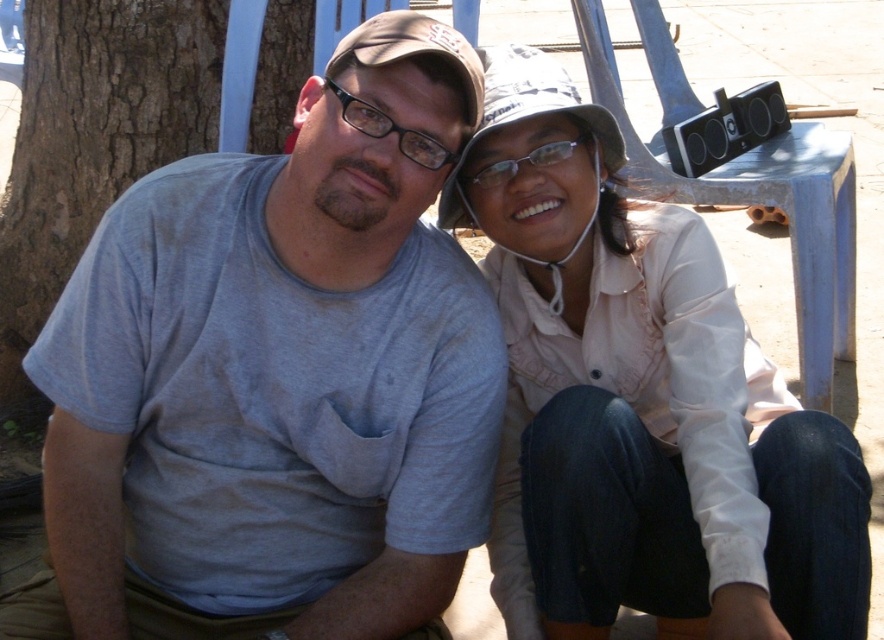
Question: Among these points, which one is nearest to the camera?

Choices:
 (A) (608, 140)
 (B) (593, 140)
 (C) (414, 545)
 (D) (856, 532)

Answer: (D)

Question: Which object is closer to the camera taking this photo?

Choices:
 (A) brown rough bark at left
 (B) clear plastic glasses at center

Answer: (B)

Question: Which object is positioned closest to the brown rough bark at left?

Choices:
 (A) clear plastic glasses at center
 (B) brown fabric baseball hat at center
 (C) gray cotton t-shirt at left
 (D) light pink fabric shirt at center

Answer: (B)

Question: In this image, where is brown rough bark at left located relative to clear plastic glasses at center?

Choices:
 (A) left
 (B) right

Answer: (A)

Question: In this image, where is light pink fabric shirt at center located relative to brown rough bark at left?

Choices:
 (A) left
 (B) right

Answer: (B)

Question: Does light pink fabric shirt at center have a larger size compared to brown fabric baseball hat at center?

Choices:
 (A) no
 (B) yes

Answer: (B)